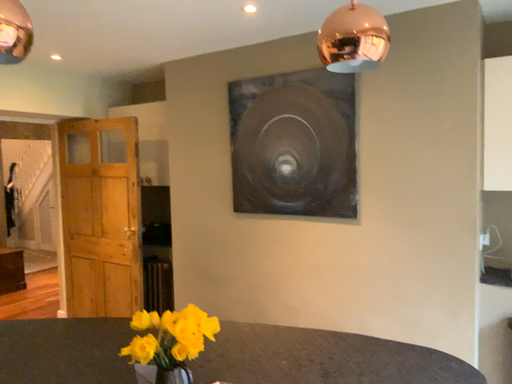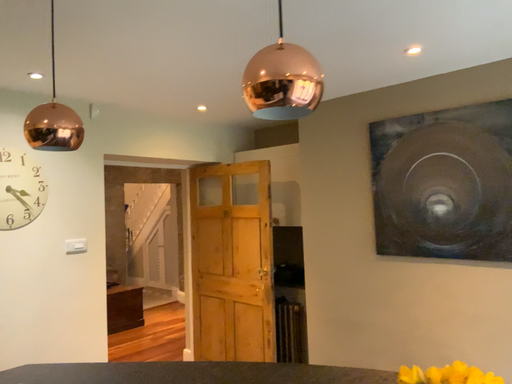
Question: Which way did the camera rotate in the video?

Choices:
 (A) rotated right
 (B) rotated left

Answer: (B)